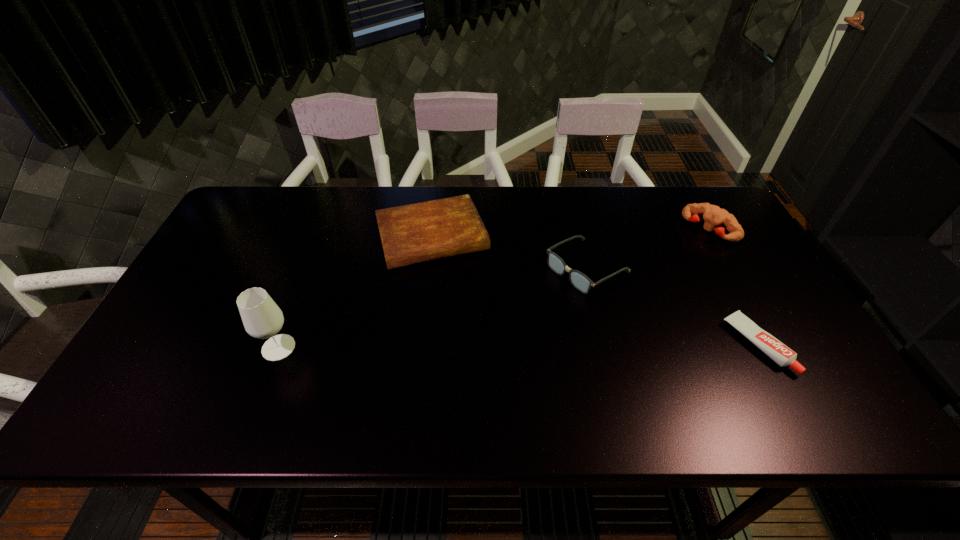
Locate an element on the screen. free space located on the spine side of the second shortest object is located at coordinates (451, 286).

The image size is (960, 540). I want to click on vacant space located 0.210m on the spine side of the second shortest object, so click(466, 328).

Find the location of `vacant space located 0.180m on the spine side of the second shortest object`. vacant space located 0.180m on the spine side of the second shortest object is located at coordinates (463, 319).

Where is `vacant space located 0.070m with the gloves of the second tallest object facing forward`? The height and width of the screenshot is (540, 960). vacant space located 0.070m with the gloves of the second tallest object facing forward is located at coordinates (685, 251).

The height and width of the screenshot is (540, 960). Identify the location of vacant region located 0.230m with the gloves of the second tallest object facing forward. (656, 277).

Identify the location of blank area located 0.060m with the gloves of the second tallest object facing forward. This screenshot has width=960, height=540. (687, 249).

Locate an element on the screen. This screenshot has width=960, height=540. free region located 0.150m on the face of the third tallest object is located at coordinates (516, 313).

The width and height of the screenshot is (960, 540). Find the location of `vacant space located 0.070m on the face of the third tallest object`. vacant space located 0.070m on the face of the third tallest object is located at coordinates (539, 299).

What are the coordinates of `free space located on the face of the third tallest object` in the screenshot? It's located at coord(469,342).

This screenshot has height=540, width=960. What are the coordinates of `Bible at the far edge` in the screenshot? It's located at (426, 231).